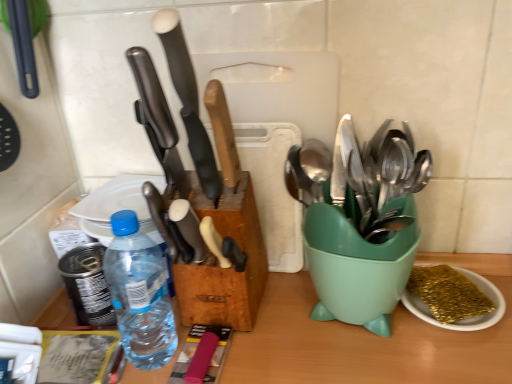
Question: Visually, is wooden-handled knife at center, arranged as the first kitchen knife when viewed from the right, positioned to the left or to the right of white plastic plate at upper left?

Choices:
 (A) right
 (B) left

Answer: (A)

Question: Is point (231, 182) closer or farther from the camera than point (109, 208)?

Choices:
 (A) closer
 (B) farther

Answer: (A)

Question: Based on their relative distances, which object is nearer to the green plastic spoon holder at right?

Choices:
 (A) matte black knife at center, which appears as the 2th kitchen knife when viewed from the left
 (B) transparent plastic bottle at center
 (C) gold glitter sponge at lower right
 (D) white plastic plate at upper left
 (E) wooden-handled knife at center, acting as the 3th kitchen knife starting from the left

Answer: (C)

Question: Which of these objects is positioned farthest from the gold glitter sponge at lower right?

Choices:
 (A) matte black knife at center, which appears as the 2th kitchen knife when viewed from the left
 (B) green plastic spoon holder at right
 (C) white plastic plate at upper left
 (D) transparent plastic bottle at center
 (E) polished black knife at center, acting as the third kitchen knife starting from the right

Answer: (C)